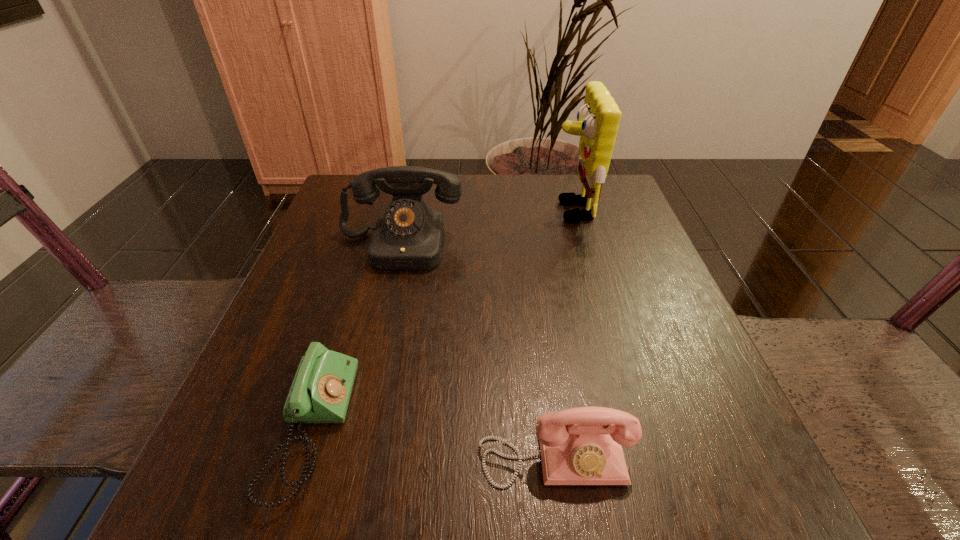
Locate an element on the screen. vacant region located 0.140m on the dial of the shortest telephone is located at coordinates (444, 428).

Find the location of a particular element. sponge that is at the far edge is located at coordinates tap(598, 119).

Find the location of a particular element. telephone that is at the far edge is located at coordinates (408, 236).

Where is `sponge located at the right edge`? sponge located at the right edge is located at coordinates (598, 119).

Image resolution: width=960 pixels, height=540 pixels. I want to click on telephone that is at the right edge, so click(579, 446).

You are a GUI agent. You are given a task and a screenshot of the screen. Output one action in this format:
    pyautogui.click(x=<x>, y=<y>)
    Task: Click on the object that is at the far left corner
    This screenshot has width=960, height=540.
    Given the screenshot: What is the action you would take?
    (408, 236)

Locate an element on the screen. object positioned at the near left corner is located at coordinates (320, 393).

This screenshot has height=540, width=960. Find the location of `object present at the far right corner`. object present at the far right corner is located at coordinates (598, 119).

This screenshot has width=960, height=540. Find the location of `object located at the near right corner`. object located at the near right corner is located at coordinates (579, 446).

In the image, there is a desktop. Where is `free region at the far edge`? The width and height of the screenshot is (960, 540). free region at the far edge is located at coordinates (427, 193).